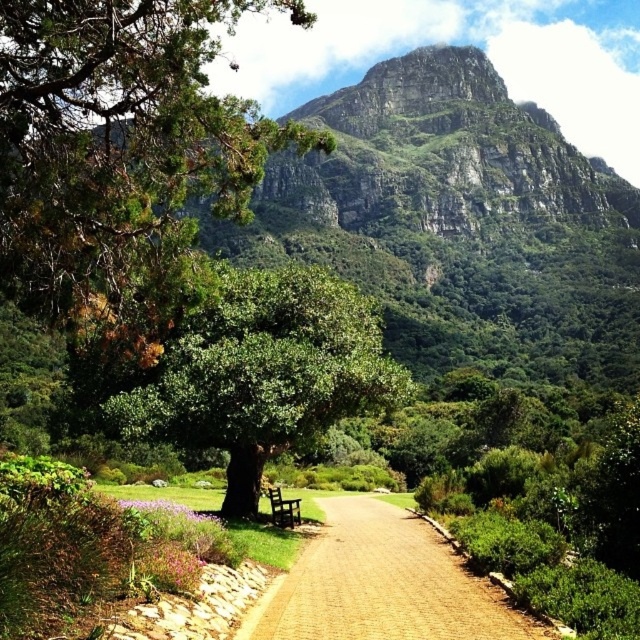
You are standing at the entrance of the pathway made of reddish brown bricks in the foreground of the scene. You notice a point labeled as point [118,145] in the image. Based on the scene description, what is the object located at this coordinate?

The point [118,145] corresponds to green needle like at upper left.